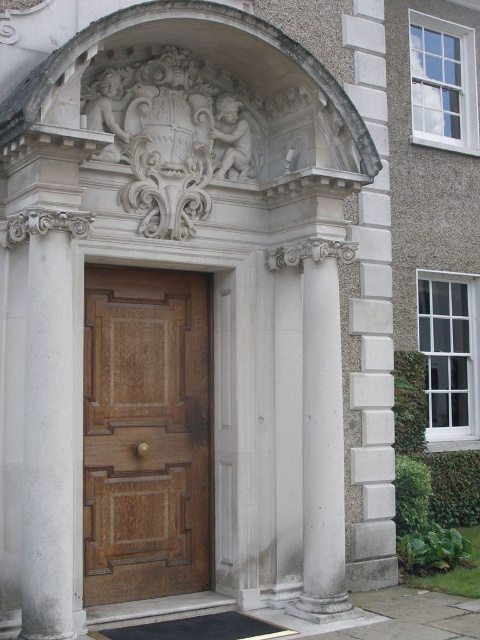
Question: Is the position of wooden door at center more distant than that of white stone column at right?

Choices:
 (A) yes
 (B) no

Answer: (B)

Question: Which of the following is the farthest from the observer?

Choices:
 (A) white stone column at right
 (B) wooden door at center

Answer: (A)

Question: Is wooden door at center closer to the viewer compared to white stone column at right?

Choices:
 (A) no
 (B) yes

Answer: (B)

Question: Which object appears closest to the camera in this image?

Choices:
 (A) white stone column at right
 (B) wooden door at center

Answer: (B)

Question: Does wooden door at center appear over white stone column at right?

Choices:
 (A) yes
 (B) no

Answer: (A)